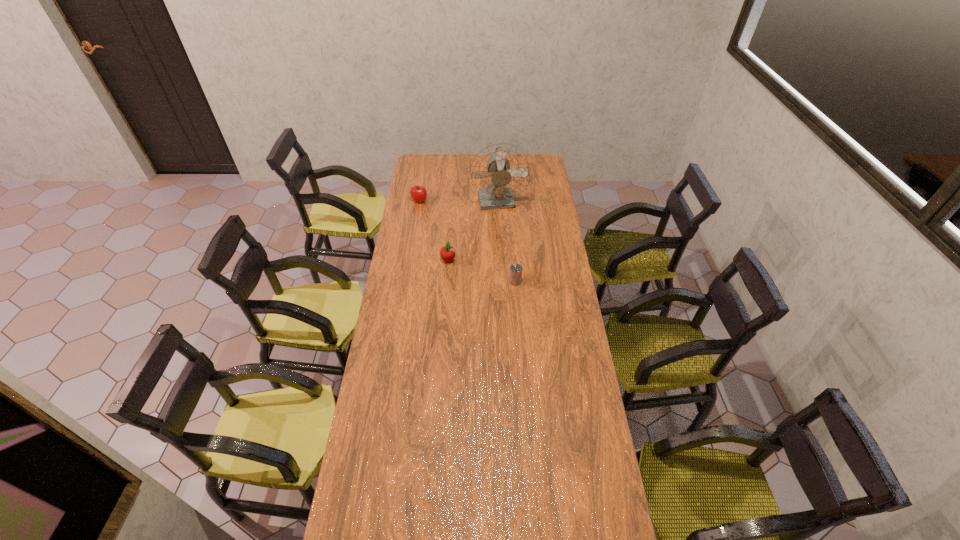
Identify the location of unoccupied position between the beer can and the fan. (507, 242).

At what (x,y) coordinates should I click in order to perform the action: click on the second closest object to the farther apple. Please return your answer as a coordinate pair (x, y). Looking at the image, I should click on (447, 253).

Select which object appears as the closest to the farther apple. Please provide its 2D coordinates. Your answer should be formatted as a tuple, i.e. [(x, y)], where the tuple contains the x and y coordinates of a point satisfying the conditions above.

[(499, 172)]

Locate an element on the screen. This screenshot has width=960, height=540. free spot that satisfies the following two spatial constraints: 1. on the front side of the second object from left to right; 2. on the right side of the left apple is located at coordinates (410, 260).